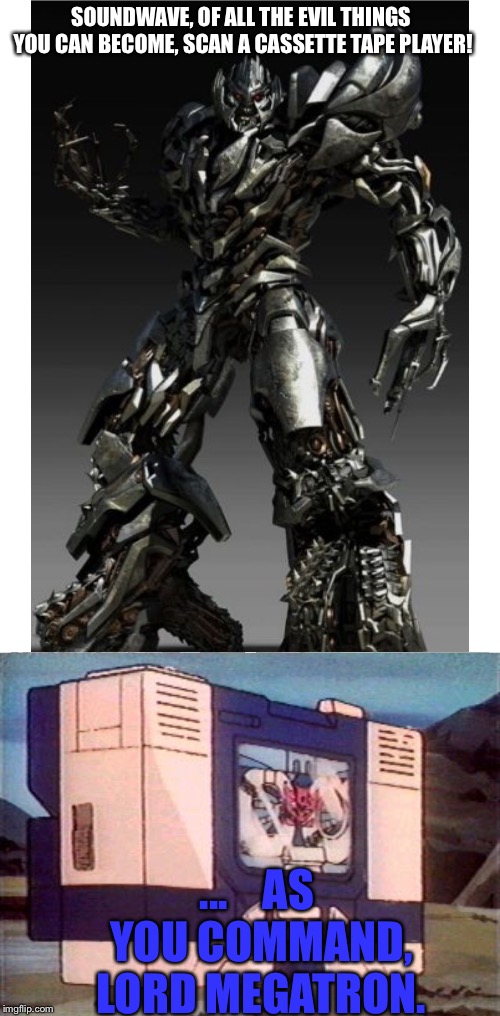
Where is `tv`? Image resolution: width=500 pixels, height=1016 pixels. tv is located at coordinates (305, 802).